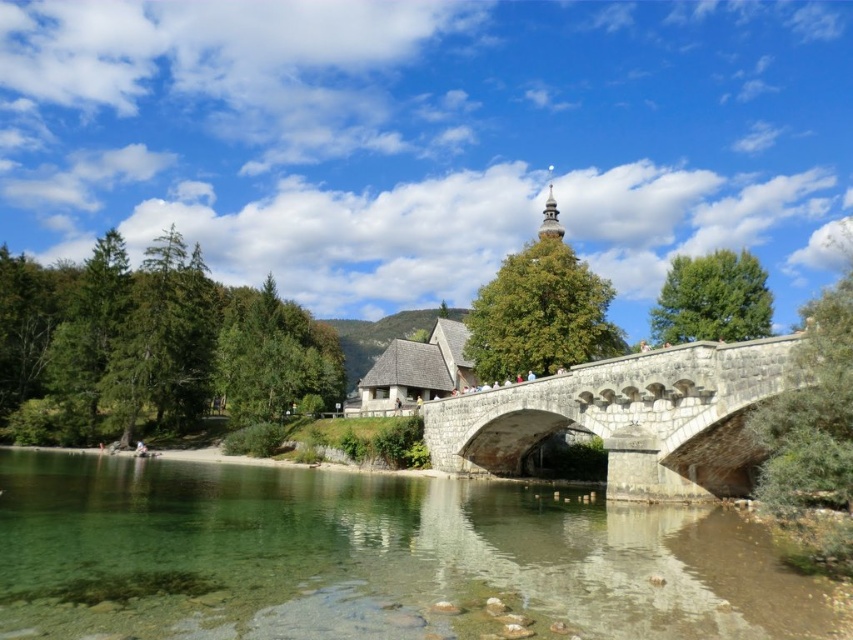
Question: Does clear water at river right appear on the left side of stone bridge at center?

Choices:
 (A) no
 (B) yes

Answer: (B)

Question: Does clear water at river right appear on the left side of stone bridge at center?

Choices:
 (A) yes
 (B) no

Answer: (A)

Question: Which point is closer to the camera?

Choices:
 (A) [x=577, y=384]
 (B) [x=636, y=637]

Answer: (B)

Question: Is clear water at river right positioned in front of stone bridge at center?

Choices:
 (A) no
 (B) yes

Answer: (B)